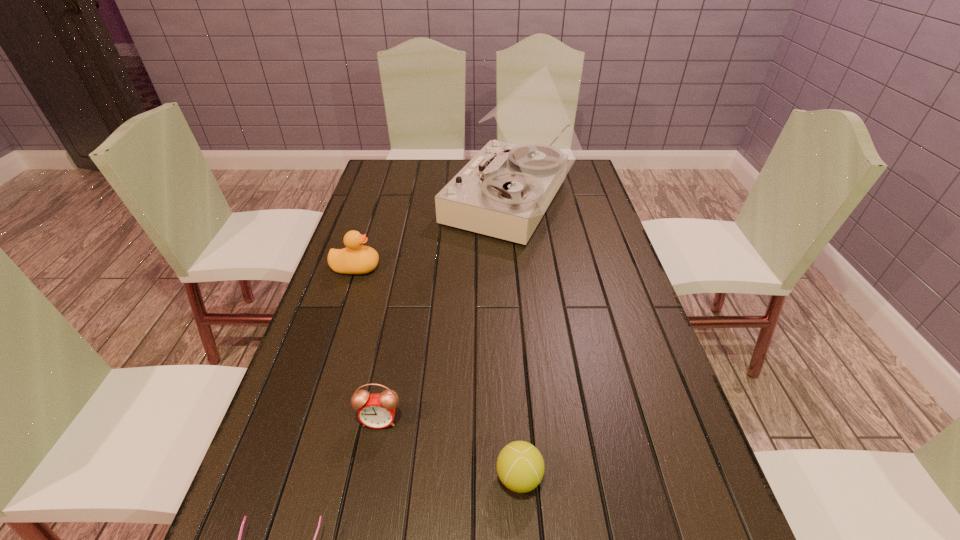
The image size is (960, 540). Find the location of `free space located 0.190m on the right of the second shortest object`. free space located 0.190m on the right of the second shortest object is located at coordinates click(641, 477).

Where is `object at the far edge`? object at the far edge is located at coordinates (505, 189).

Where is `object that is at the left edge`? This screenshot has width=960, height=540. object that is at the left edge is located at coordinates (356, 258).

At what (x,y) coordinates should I click in order to perform the action: click on object at the right edge. Please return your answer as a coordinate pair (x, y). The width and height of the screenshot is (960, 540). Looking at the image, I should click on (505, 189).

Find the location of `object positioned at the far right corner`. object positioned at the far right corner is located at coordinates (505, 189).

Locate an element on the screen. free space at the left edge of the desktop is located at coordinates (367, 211).

Where is `free space at the right edge`? The width and height of the screenshot is (960, 540). free space at the right edge is located at coordinates (656, 347).

Locate an element on the screen. free space at the far right corner is located at coordinates (587, 166).

Identify the location of vacant area that lies between the duck and the third farthest object. The width and height of the screenshot is (960, 540). point(368,344).

The height and width of the screenshot is (540, 960). What are the coordinates of `free space between the third object from left to right and the second farthest object` in the screenshot? It's located at (368, 344).